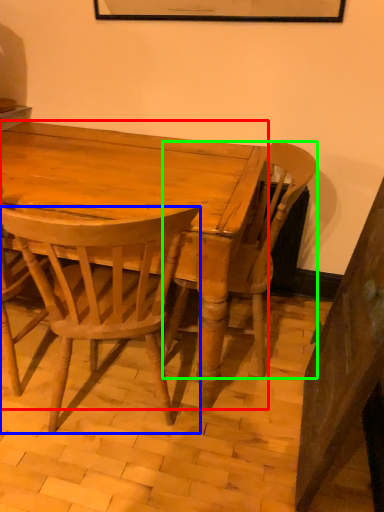
Question: Which object is positioned closest to desk (highlighted by a red box)? Select from chair (highlighted by a blue box) and chair (highlighted by a green box).

Choices:
 (A) chair
 (B) chair

Answer: (A)